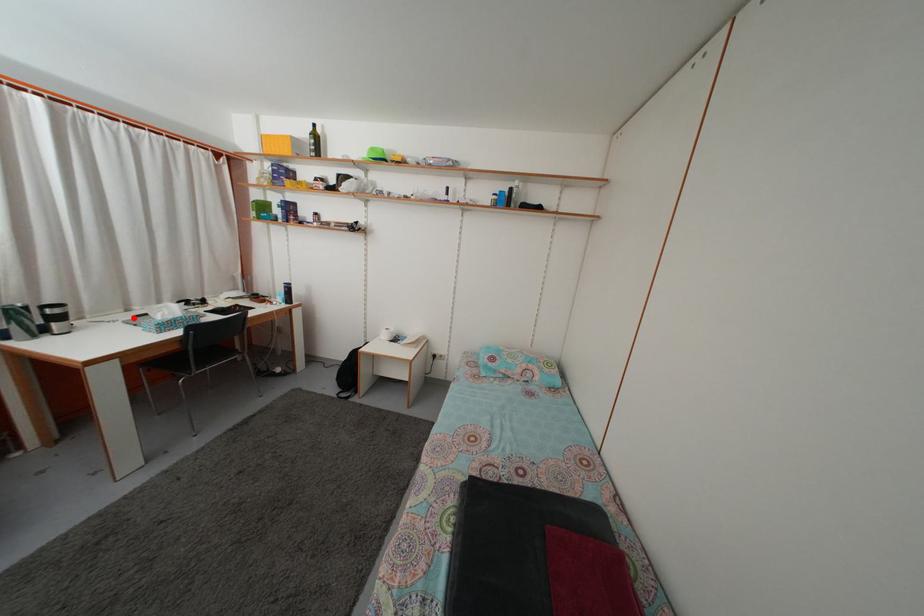
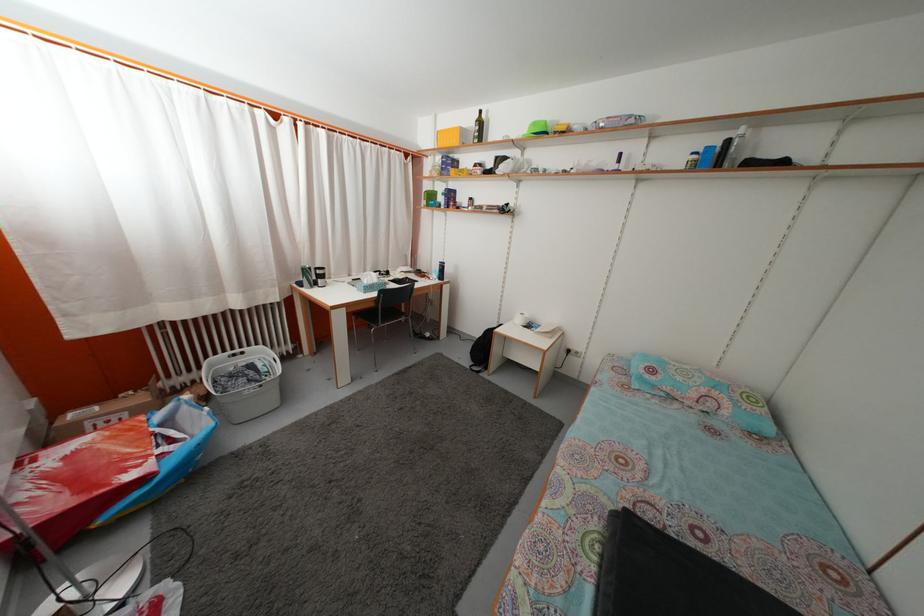
In the second image, find the point that corresponds to the highlighted location in the first image.

(355, 283)